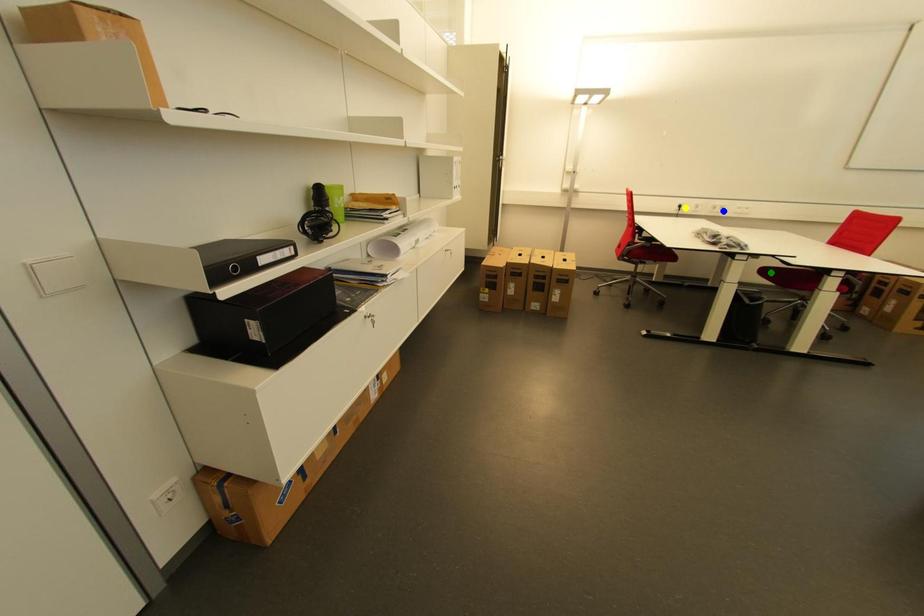
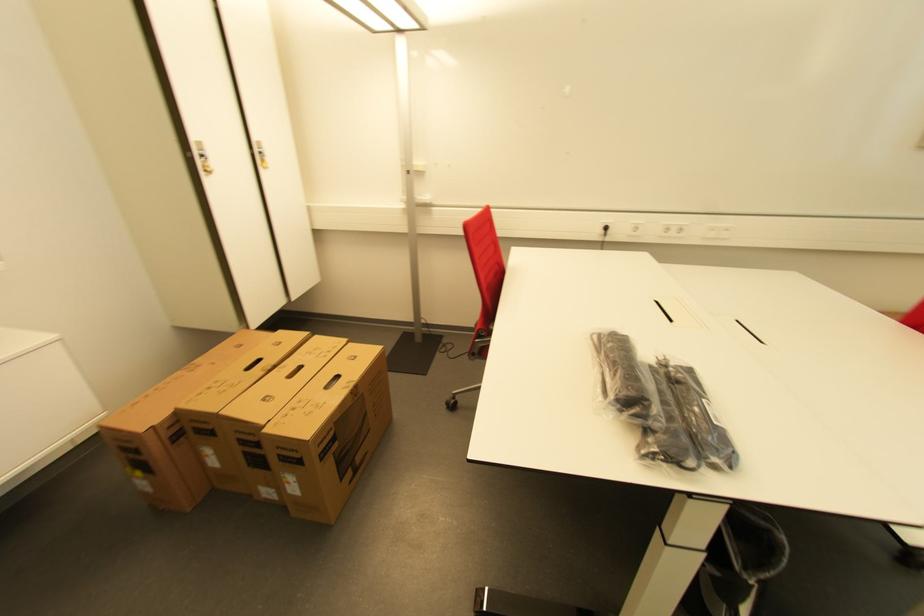
I am providing you with two images of the same scene from different viewpoints. Three points are marked in image1. Which point corresponds to a part or object that is occluded in image2?In image1, three points are marked. Which of them correspond to a part or object that is occluded in image2?Among the three points shown in image1, which one corresponds to a part or object that is no longer visible due to occlusion in image2?

Invisible in image2: green point.